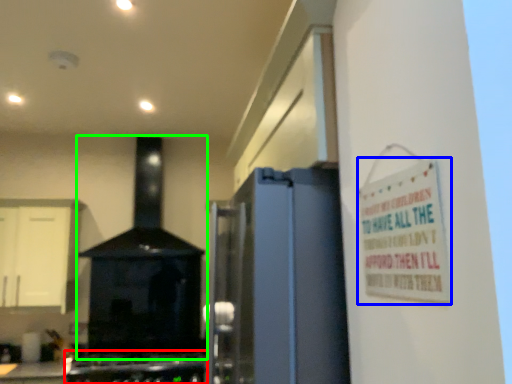
Question: Based on their relative distances, which object is nearer to gas stove (highlighted by a red box)? Choose from warning sign (highlighted by a blue box) and home appliance (highlighted by a green box).

Choices:
 (A) warning sign
 (B) home appliance

Answer: (B)